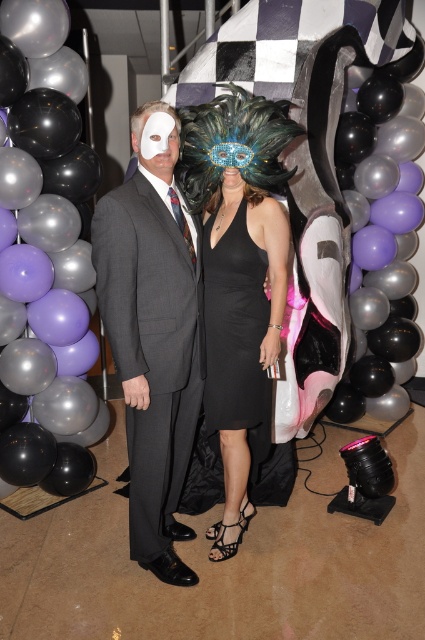
Question: Is black glossy balloon at left to the right of black satin dress at center from the viewer's perspective?

Choices:
 (A) no
 (B) yes

Answer: (A)

Question: Considering the relative positions of black glossy balloon at left and black satin dress at center in the image provided, where is black glossy balloon at left located with respect to black satin dress at center?

Choices:
 (A) left
 (B) right

Answer: (A)

Question: Which object is closer to the camera taking this photo?

Choices:
 (A) black sheer dress at center
 (B) matte gray suit at center
 (C) black satin dress at center

Answer: (B)

Question: Does matte gray suit at center come behind black sheer dress at center?

Choices:
 (A) no
 (B) yes

Answer: (A)

Question: Which point is farther from the camera taking this photo?

Choices:
 (A) (11, 246)
 (B) (255, 340)

Answer: (A)

Question: Which point appears closest to the camera in this image?

Choices:
 (A) (232, 113)
 (B) (82, 163)
 (C) (193, 333)

Answer: (A)